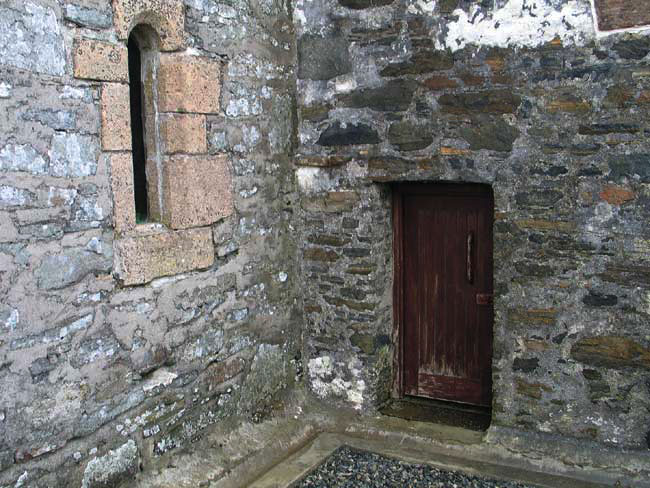
Identify the location of arch. This screenshot has width=650, height=488. (147, 23).